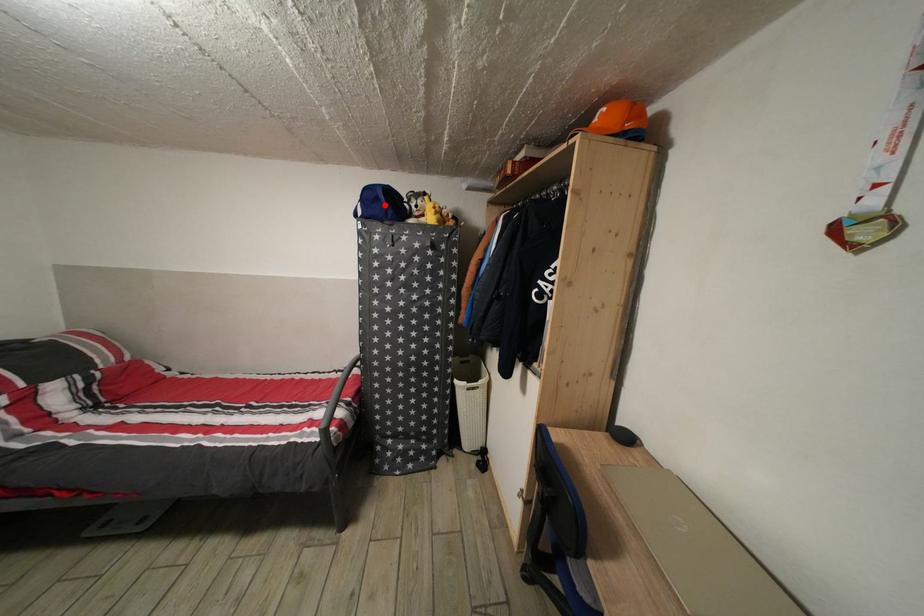
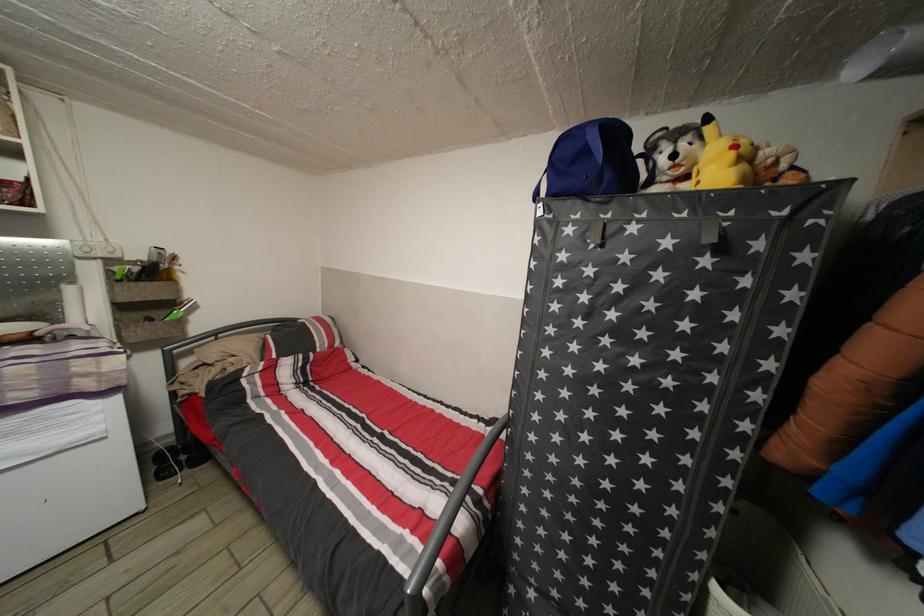
Find the pixel in the second image that matches the highlighted location in the first image.

(591, 158)